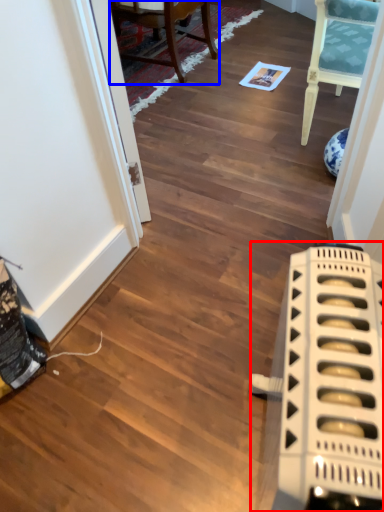
Question: Among these objects, which one is nearest to the camera, appliance (highlighted by a red box) or chair (highlighted by a blue box)?

Choices:
 (A) appliance
 (B) chair

Answer: (A)